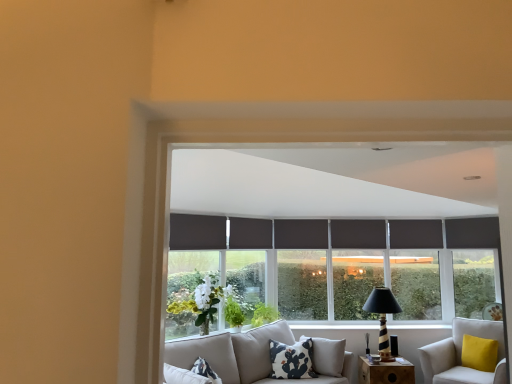
Question: Is white cotton pillow with black cactus print at center bigger than white fabric studio couch at lower right?

Choices:
 (A) yes
 (B) no

Answer: (B)

Question: Does white cotton pillow with black cactus print at center have a greater height compared to white fabric studio couch at lower right?

Choices:
 (A) no
 (B) yes

Answer: (A)

Question: Is white cotton pillow with black cactus print at center not within white fabric studio couch at lower right?

Choices:
 (A) no
 (B) yes

Answer: (B)

Question: Is white cotton pillow with black cactus print at center not close to white fabric studio couch at lower right?

Choices:
 (A) no
 (B) yes

Answer: (B)

Question: Does white cotton pillow with black cactus print at center appear on the left side of white fabric studio couch at lower right?

Choices:
 (A) yes
 (B) no

Answer: (A)

Question: Looking at their shapes, would you say white cotton pillow with black cactus print at center is wider or thinner than dark gray fabric curtain at center, placed as the 1th curtain when sorted from right to left?

Choices:
 (A) thin
 (B) wide

Answer: (B)

Question: Is white cotton pillow with black cactus print at center in front of or behind dark gray fabric curtain at center, the 3th curtain in the front-to-back sequence, in the image?

Choices:
 (A) front
 (B) behind

Answer: (A)

Question: Is white cotton pillow with black cactus print at center situated inside dark gray fabric curtain at center, the third curtain positioned from the left, or outside?

Choices:
 (A) outside
 (B) inside

Answer: (A)

Question: From the image's perspective, is white cotton pillow with black cactus print at center positioned above or below dark gray fabric curtain at center, placed as the 1th curtain when sorted from right to left?

Choices:
 (A) below
 (B) above

Answer: (A)

Question: Relative to striped wood table lamp at lower right, is white fabric studio couch at lower right in front or behind?

Choices:
 (A) front
 (B) behind

Answer: (A)

Question: From the image's perspective, is white fabric studio couch at lower right positioned above or below striped wood table lamp at lower right?

Choices:
 (A) below
 (B) above

Answer: (A)

Question: Is white fabric studio couch at lower right wider or thinner than striped wood table lamp at lower right?

Choices:
 (A) thin
 (B) wide

Answer: (B)

Question: From a real-world perspective, is white fabric studio couch at lower right physically located above or below striped wood table lamp at lower right?

Choices:
 (A) below
 (B) above

Answer: (A)

Question: Looking at the image, does striped wood table lamp at lower right seem bigger or smaller compared to white cotton pillow with black cactus print at center?

Choices:
 (A) big
 (B) small

Answer: (A)

Question: From a real-world perspective, relative to white cotton pillow with black cactus print at center, is striped wood table lamp at lower right vertically above or below?

Choices:
 (A) above
 (B) below

Answer: (A)